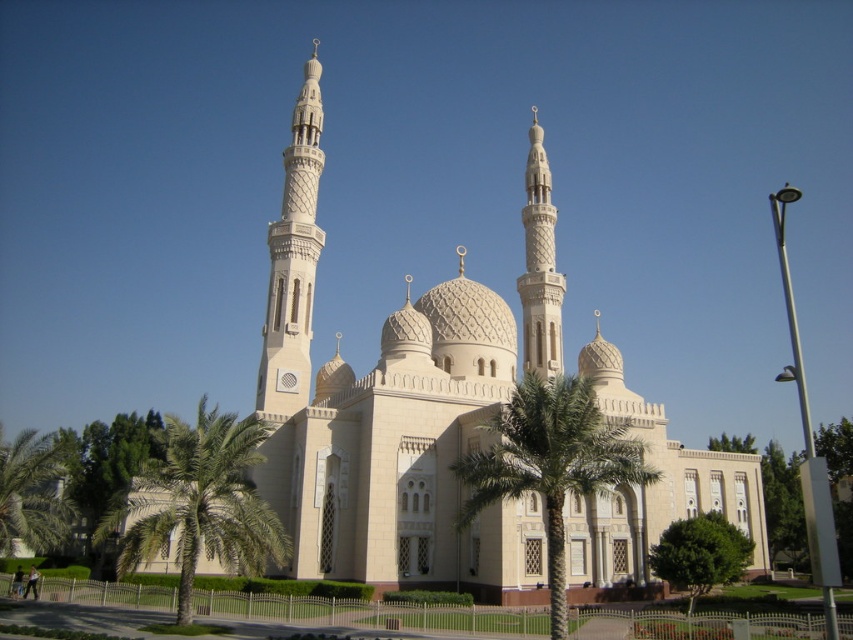
Question: Is green leafy palm tree at left behind green leafy palm tree at lower left?

Choices:
 (A) no
 (B) yes

Answer: (A)

Question: Is green leafy palm tree at center to the left of white textured minaret at center-left from the viewer's perspective?

Choices:
 (A) yes
 (B) no

Answer: (B)

Question: Does green leafy palm tree at left appear over green leafy palm tree at lower left?

Choices:
 (A) no
 (B) yes

Answer: (B)

Question: Among these points, which one is farthest from the camera?

Choices:
 (A) (299, 170)
 (B) (560, 429)

Answer: (A)

Question: Estimate the real-world distances between objects in this image. Which object is farther from the white textured minaret at center-left?

Choices:
 (A) white stone minaret at center
 (B) green leafy palm tree at lower left

Answer: (B)

Question: Which point appears farthest from the camera in this image?

Choices:
 (A) (473, 493)
 (B) (285, 257)
 (C) (552, 264)
 (D) (201, 472)

Answer: (C)